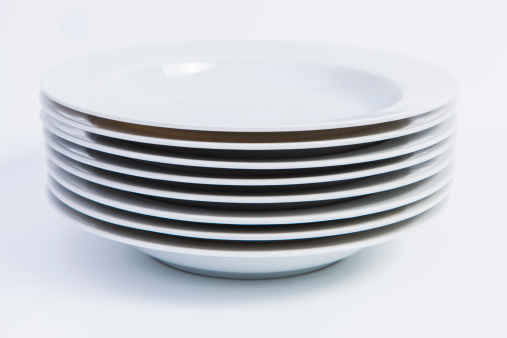
You are a GUI agent. You are given a task and a screenshot of the screen. Output one action in this format:
    pyautogui.click(x=<x>, y=<y>)
    Task: Click on the bowls
    This screenshot has width=507, height=338.
    Given the screenshot: What is the action you would take?
    pyautogui.click(x=129, y=122), pyautogui.click(x=131, y=137), pyautogui.click(x=133, y=155), pyautogui.click(x=133, y=167), pyautogui.click(x=135, y=186), pyautogui.click(x=136, y=203), pyautogui.click(x=139, y=222), pyautogui.click(x=141, y=244)